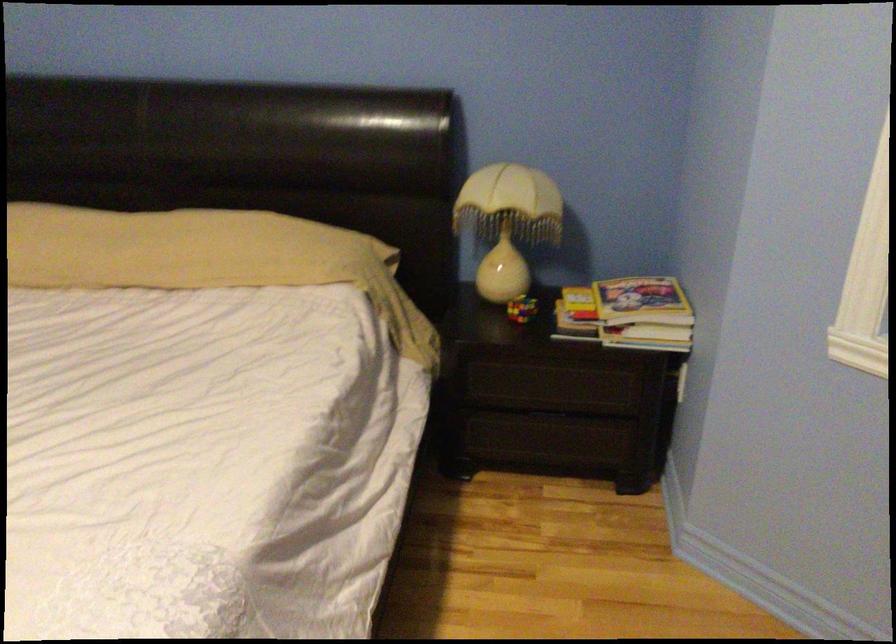
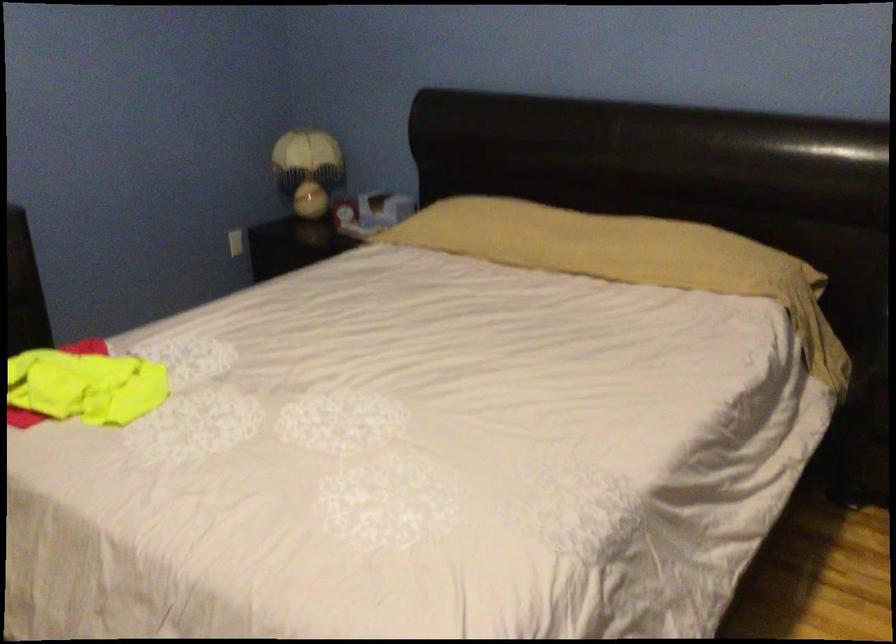
Question: What movement of the cameraman would produce the second image?

Choices:
 (A) Left
 (B) Right
 (C) Forward
 (D) Backward

Answer: (D)